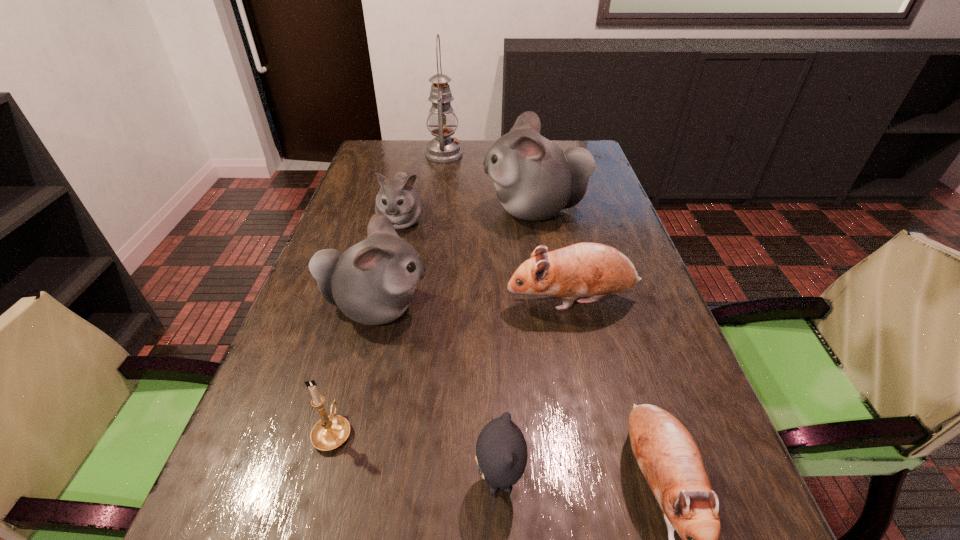
Locate an element on the screen. The height and width of the screenshot is (540, 960). vacant area situated 0.090m on the left of the oil lamp is located at coordinates (399, 154).

You are a GUI agent. You are given a task and a screenshot of the screen. Output one action in this format:
    pyautogui.click(x=<x>, y=<y>)
    Task: Click on the free space located on the face of the tallest hamster
    This screenshot has width=960, height=540.
    Given the screenshot: What is the action you would take?
    pyautogui.click(x=442, y=210)

The height and width of the screenshot is (540, 960). What are the coordinates of `free space located 0.090m on the face of the tallest hamster` in the screenshot? It's located at (452, 210).

Locate an element on the screen. This screenshot has height=540, width=960. free point located on the face of the tallest hamster is located at coordinates (384, 210).

Find the location of a particular element. This screenshot has height=540, width=960. free space located on the face of the second biggest white hamster is located at coordinates (502, 308).

The height and width of the screenshot is (540, 960). Find the location of `vacant space located 0.250m on the face of the smallest white hamster`. vacant space located 0.250m on the face of the smallest white hamster is located at coordinates (381, 306).

Locate an element on the screen. This screenshot has height=540, width=960. free space located 0.230m at the face of the farther brown hamster is located at coordinates (404, 301).

Image resolution: width=960 pixels, height=540 pixels. Find the location of `free point located at the face of the farther brown hamster`. free point located at the face of the farther brown hamster is located at coordinates (351, 301).

In order to click on vacant space located 0.370m at the face of the farther brown hamster in this screenshot , I will do `click(343, 301)`.

Where is `vacant region located 0.140m on the handle side of the gold candle holder`? This screenshot has width=960, height=540. vacant region located 0.140m on the handle side of the gold candle holder is located at coordinates (355, 349).